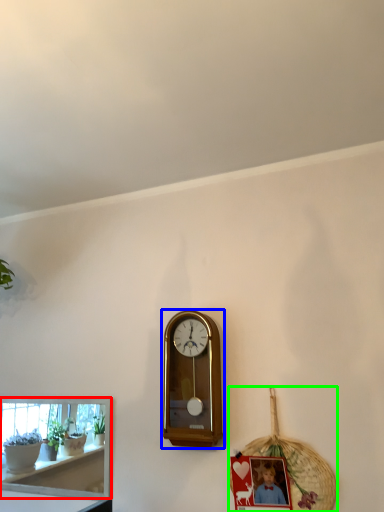
Question: Considering the real-world distances, which object is closest to shelf (highlighted by a red box)? wall clock (highlighted by a blue box) or basket (highlighted by a green box).

Choices:
 (A) wall clock
 (B) basket

Answer: (A)